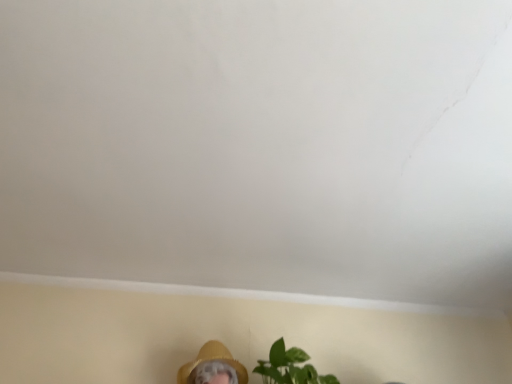
Question: From a real-world perspective, is yellow straw hat at lower center physically below green matte plant at lower center?

Choices:
 (A) yes
 (B) no

Answer: (B)

Question: Can you confirm if yellow straw hat at lower center is wider than green matte plant at lower center?

Choices:
 (A) yes
 (B) no

Answer: (B)

Question: Is yellow straw hat at lower center shorter than green matte plant at lower center?

Choices:
 (A) yes
 (B) no

Answer: (A)

Question: Would you consider yellow straw hat at lower center to be distant from green matte plant at lower center?

Choices:
 (A) yes
 (B) no

Answer: (B)

Question: From a real-world perspective, is yellow straw hat at lower center on green matte plant at lower center?

Choices:
 (A) no
 (B) yes

Answer: (B)

Question: Does yellow straw hat at lower center have a smaller size compared to green matte plant at lower center?

Choices:
 (A) yes
 (B) no

Answer: (A)

Question: Is green matte plant at lower center to the right of yellow straw hat at lower center from the viewer's perspective?

Choices:
 (A) yes
 (B) no

Answer: (A)

Question: Can you confirm if green matte plant at lower center is positioned to the left of yellow straw hat at lower center?

Choices:
 (A) no
 (B) yes

Answer: (A)

Question: Is there a large distance between green matte plant at lower center and yellow straw hat at lower center?

Choices:
 (A) yes
 (B) no

Answer: (B)

Question: Is yellow straw hat at lower center a part of green matte plant at lower center?

Choices:
 (A) yes
 (B) no

Answer: (B)

Question: Is green matte plant at lower center facing towards yellow straw hat at lower center?

Choices:
 (A) yes
 (B) no

Answer: (B)

Question: From the image's perspective, is green matte plant at lower center under yellow straw hat at lower center?

Choices:
 (A) yes
 (B) no

Answer: (B)

Question: Is green matte plant at lower center situated inside yellow straw hat at lower center or outside?

Choices:
 (A) outside
 (B) inside

Answer: (A)